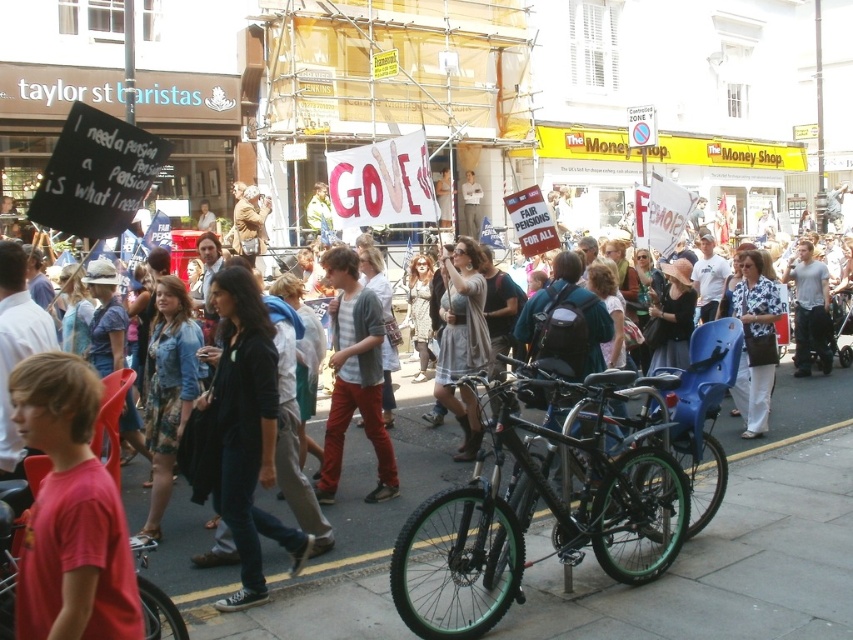
You are a photographer trying to capture the protest scene. You notice two individuals in the crowd wearing a red matte shirt at lower left and a white cotton dress at center. Which of these two clothing items is smaller in size?

The red matte shirt at lower left has a smaller size compared to the white cotton dress at center.